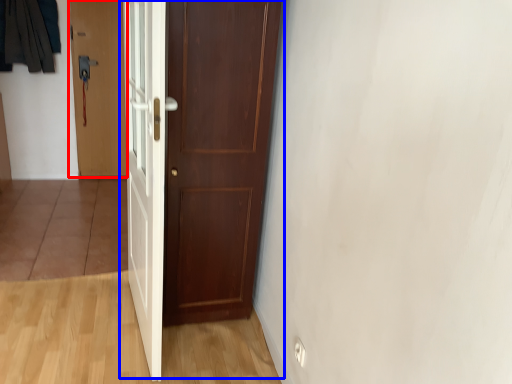
Question: Which object is closer to the camera taking this photo, door (highlighted by a red box) or door (highlighted by a blue box)?

Choices:
 (A) door
 (B) door

Answer: (B)